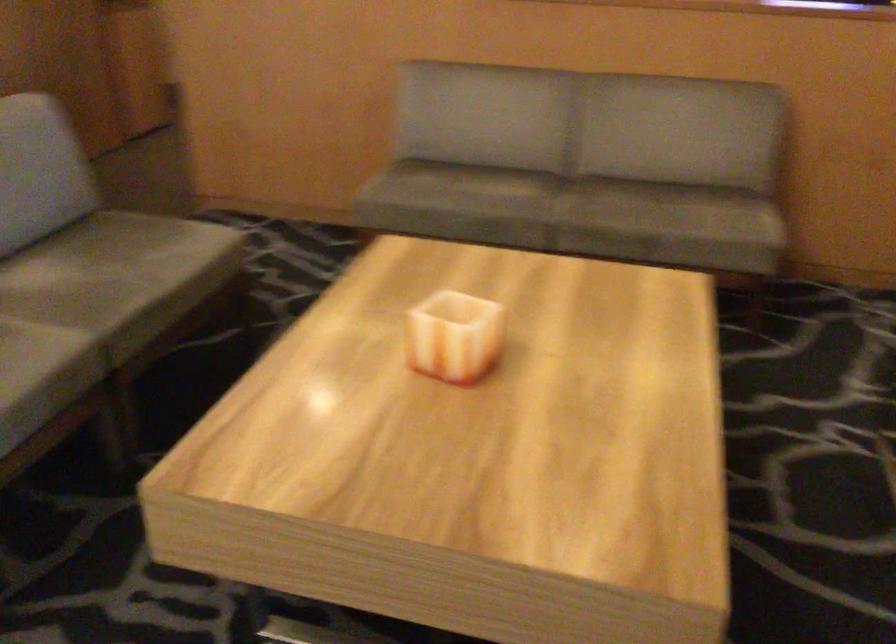
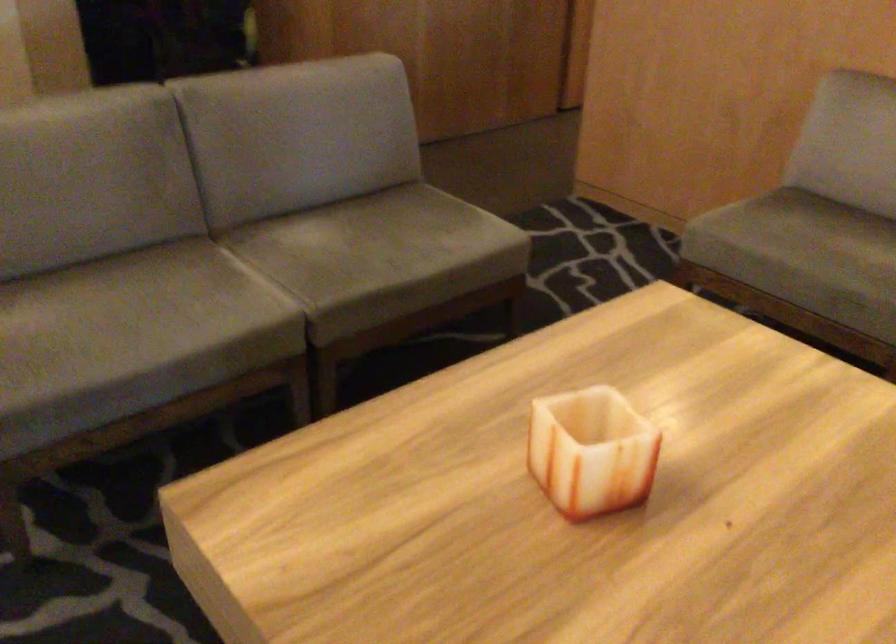
The point at (133, 267) is marked in the first image. Where is the corresponding point in the second image?

(385, 247)